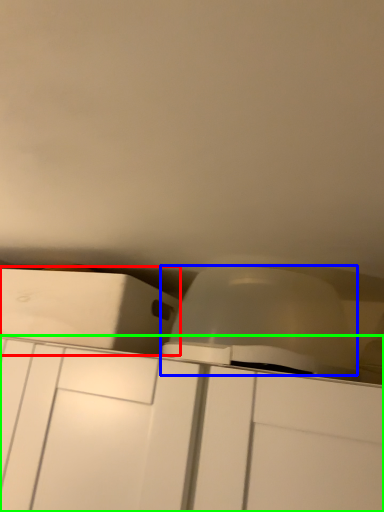
Question: Which object is positioned farthest from cabinetry (highlighted by a red box)? Select from lift (highlighted by a blue box) and cabinetry (highlighted by a green box).

Choices:
 (A) lift
 (B) cabinetry

Answer: (A)